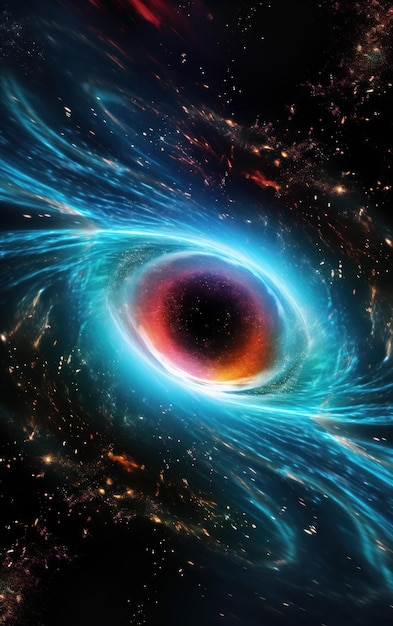
In order to click on light stripe in this screenshot , I will do `click(170, 240)`.